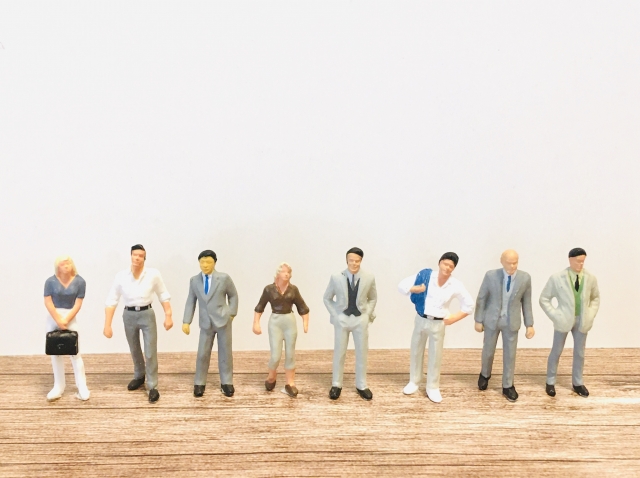
You are a GUI agent. You are given a task and a screenshot of the screen. Output one action in this format:
    pyautogui.click(x=<x>, y=<y>)
    Task: Click on the figurines wearing a tie
    The image size is (640, 478).
    Given the screenshot: What is the action you would take?
    pyautogui.click(x=208, y=293), pyautogui.click(x=356, y=294), pyautogui.click(x=497, y=298), pyautogui.click(x=575, y=297)